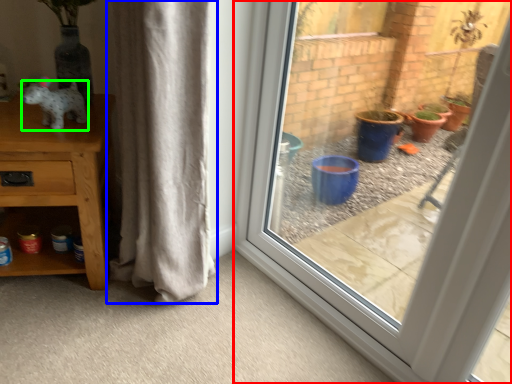
Question: Considering the real-world distances, which object is farthest from window (highlighted by a red box)? curtain (highlighted by a blue box) or animal (highlighted by a green box)?

Choices:
 (A) curtain
 (B) animal

Answer: (B)